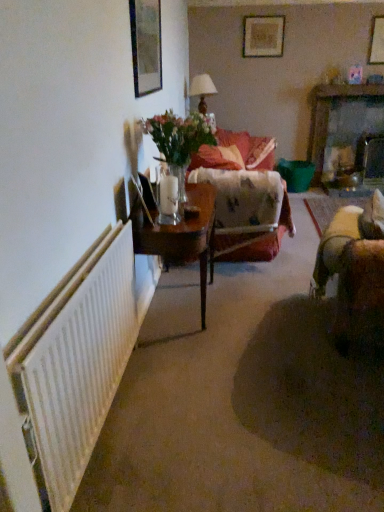
Question: Should I look upward or downward to see clear glass vase at center?

Choices:
 (A) down
 (B) up

Answer: (B)

Question: From the image's perspective, is clear glass vase at center located beneath wooden table at left?

Choices:
 (A) yes
 (B) no

Answer: (B)

Question: From a real-world perspective, is clear glass vase at center on wooden table at left?

Choices:
 (A) yes
 (B) no

Answer: (A)

Question: Are clear glass vase at center and wooden table at left making contact?

Choices:
 (A) no
 (B) yes

Answer: (A)

Question: Can you confirm if clear glass vase at center is wider than wooden table at left?

Choices:
 (A) yes
 (B) no

Answer: (B)

Question: Could you tell me if clear glass vase at center is turned towards wooden table at left?

Choices:
 (A) yes
 (B) no

Answer: (B)

Question: From a real-world perspective, is clear glass vase at center under wooden table at left?

Choices:
 (A) yes
 (B) no

Answer: (B)

Question: Is matte wooden picture frame at upper center, the first picture frame positioned from the left, touching matte brown table lamp at center?

Choices:
 (A) no
 (B) yes

Answer: (A)

Question: Is matte wooden picture frame at upper center, acting as the 3th picture frame starting from the top, completely or partially outside of matte brown table lamp at center?

Choices:
 (A) no
 (B) yes

Answer: (B)

Question: Can you confirm if matte wooden picture frame at upper center, acting as the 3th picture frame starting from the top, is positioned to the left of matte brown table lamp at center?

Choices:
 (A) no
 (B) yes

Answer: (B)

Question: From a real-world perspective, does matte wooden picture frame at upper center, acting as the 3th picture frame starting from the top, stand above matte brown table lamp at center?

Choices:
 (A) yes
 (B) no

Answer: (A)

Question: From the image's perspective, would you say matte wooden picture frame at upper center, marked as the 1th picture frame in a front-to-back arrangement, is shown under matte brown table lamp at center?

Choices:
 (A) yes
 (B) no

Answer: (A)

Question: Is matte wooden picture frame at upper center, marked as the 1th picture frame in a front-to-back arrangement, further to the viewer compared to matte brown table lamp at center?

Choices:
 (A) yes
 (B) no

Answer: (B)

Question: Would you say wooden picture frame at upper right, positioned as the 2th picture frame in top-to-bottom order, contains wooden table at left?

Choices:
 (A) no
 (B) yes

Answer: (A)